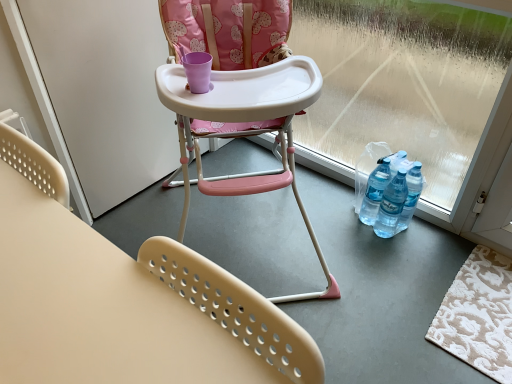
Question: Is white matte screen door at left situated inside transparent plastic window screen at lower right or outside?

Choices:
 (A) outside
 (B) inside

Answer: (A)

Question: In the image, is white matte screen door at left positioned in front of or behind transparent plastic window screen at lower right?

Choices:
 (A) behind
 (B) front

Answer: (A)

Question: Based on their relative distances, which object is nearer to the beige textured rug at lower right?

Choices:
 (A) beige plastic chair at lower center, which is the 2th chair in back-to-front order
 (B) transparent plastic window screen at lower right
 (C) pink plastic highchair at center, the 2th chair when ordered from front to back
 (D) white matte screen door at left

Answer: (B)

Question: Estimate the real-world distances between objects in this image. Which object is farther from the beige plastic chair at lower center, which is counted as the first chair, starting from the front?

Choices:
 (A) white matte screen door at left
 (B) transparent plastic window screen at lower right
 (C) beige textured rug at lower right
 (D) pink plastic highchair at center, the 1th chair from the back

Answer: (B)